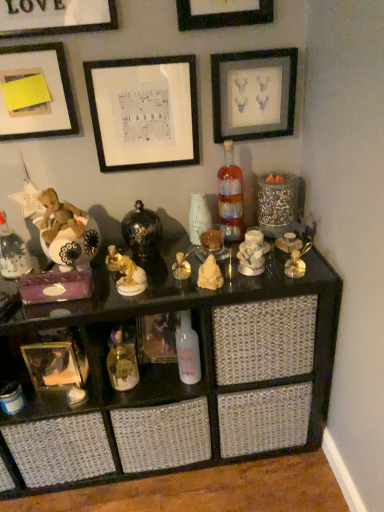
Question: Would you say black matte picture frame at upper center, the first picture frame viewed from the top, is part of gold metallic perfume bottle at center, arranged as the third toy when viewed from the left,'s contents?

Choices:
 (A) no
 (B) yes

Answer: (A)

Question: Is gold metallic perfume bottle at center, which ranks as the third toy in right-to-left order, not near black matte picture frame at upper center, the first picture frame viewed from the top?

Choices:
 (A) yes
 (B) no

Answer: (B)

Question: Does gold metallic perfume bottle at center, which ranks as the third toy in right-to-left order, have a lesser height compared to black matte picture frame at upper center, the first picture frame viewed from the top?

Choices:
 (A) yes
 (B) no

Answer: (A)

Question: From a real-world perspective, is gold metallic perfume bottle at center, arranged as the third toy when viewed from the left, located higher than black matte picture frame at upper center, the first picture frame viewed from the top?

Choices:
 (A) no
 (B) yes

Answer: (A)

Question: Is gold metallic perfume bottle at center, which ranks as the third toy in right-to-left order, turned away from black matte picture frame at upper center, the first picture frame viewed from the top?

Choices:
 (A) no
 (B) yes

Answer: (A)

Question: From the image's perspective, is gold metallic toy at lower center, the 1th toy from the left, positioned above or below white paper at upper center, which is counted as the fifth picture frame, starting from the top?

Choices:
 (A) below
 (B) above

Answer: (A)

Question: Is gold metallic toy at lower center, the 1th toy from the left, inside or outside of white paper at upper center, which is counted as the fifth picture frame, starting from the top?

Choices:
 (A) outside
 (B) inside

Answer: (A)

Question: Visually, is gold metallic toy at lower center, the fifth toy positioned from the right, positioned to the left or to the right of white paper at upper center, which is counted as the fifth picture frame, starting from the top?

Choices:
 (A) left
 (B) right

Answer: (A)

Question: Considering the positions of gold metallic toy at lower center, the fifth toy positioned from the right, and white paper at upper center, which is counted as the fifth picture frame, starting from the top, in the image, is gold metallic toy at lower center, the fifth toy positioned from the right, wider or thinner than white paper at upper center, which is counted as the fifth picture frame, starting from the top,?

Choices:
 (A) wide
 (B) thin

Answer: (A)

Question: Is gold metallic toy at lower center, the fifth toy positioned from the right, in front of or behind gold metallic perfume bottle at center, arranged as the third toy when viewed from the left, in the image?

Choices:
 (A) behind
 (B) front

Answer: (A)

Question: In the image, is gold metallic toy at lower center, the fifth toy positioned from the right, on the left side or the right side of gold metallic perfume bottle at center, which ranks as the third toy in right-to-left order?

Choices:
 (A) left
 (B) right

Answer: (A)

Question: Is gold metallic toy at lower center, the fifth toy positioned from the right, spatially inside gold metallic perfume bottle at center, arranged as the third toy when viewed from the left, or outside of it?

Choices:
 (A) outside
 (B) inside

Answer: (A)

Question: Looking at the image, does gold metallic toy at lower center, the fifth toy positioned from the right, seem bigger or smaller compared to gold metallic perfume bottle at center, arranged as the third toy when viewed from the left?

Choices:
 (A) big
 (B) small

Answer: (A)

Question: From the image's perspective, is gold metallic picture frame at lower left, the 1th picture frame ordered from the bottom, positioned above or below gold metallic toy at lower center, the fifth toy positioned from the right?

Choices:
 (A) below
 (B) above

Answer: (B)

Question: Is gold metallic picture frame at lower left, marked as the 6th picture frame in a top-to-bottom arrangement, wider or thinner than gold metallic toy at lower center, the 1th toy from the left?

Choices:
 (A) wide
 (B) thin

Answer: (A)